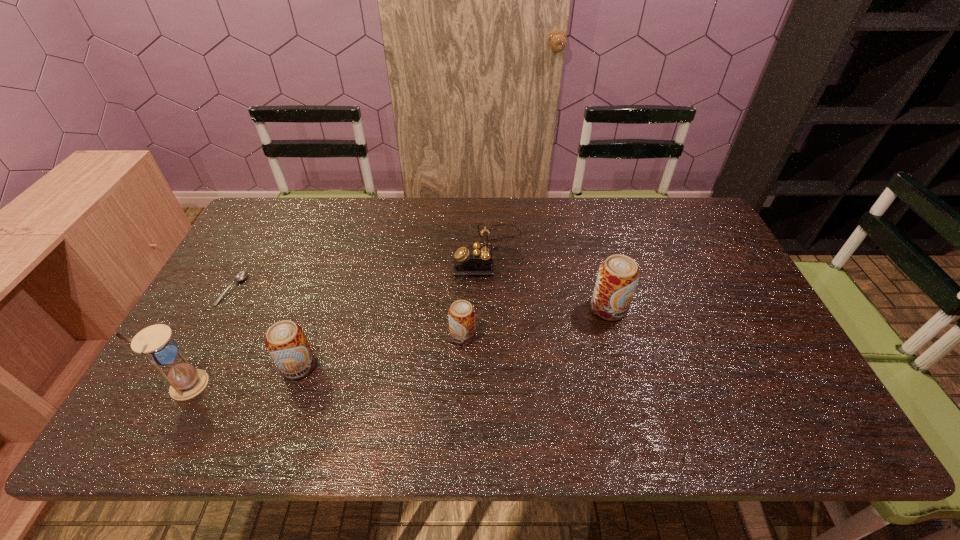
Identify the location of the second tallest beer can. (286, 342).

At what (x,y) coordinates should I click in order to perform the action: click on the leftmost beer can. Please return your answer as a coordinate pair (x, y). Image resolution: width=960 pixels, height=540 pixels. Looking at the image, I should click on (286, 342).

The image size is (960, 540). I want to click on the fourth farthest object, so click(461, 314).

Where is `the second farthest beer can`? The image size is (960, 540). the second farthest beer can is located at coordinates (461, 314).

Identify the location of the tallest beer can. (618, 275).

I want to click on the fifth shortest object, so click(618, 275).

I want to click on telephone, so click(476, 259).

At what (x,y) coordinates should I click in order to perform the action: click on the shortest object. Please return your answer as a coordinate pair (x, y). The height and width of the screenshot is (540, 960). Looking at the image, I should click on (241, 276).

Identify the location of the tallest object. This screenshot has width=960, height=540. (155, 342).

Identify the location of vacant position located 0.050m on the front of the second shortest beer can. This screenshot has height=540, width=960. (287, 400).